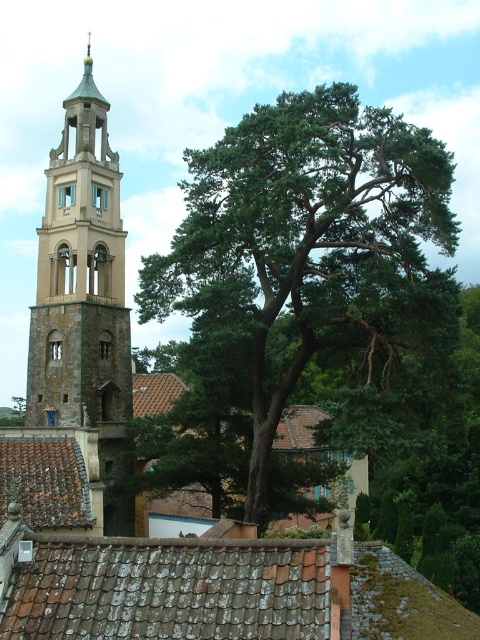
You are standing in front of the bell tower and notice a green leafy tree at center and a brown tile roof at lower center. Which object is taller?

The green leafy tree at center is taller than the brown tile roof at lower center.

You are standing in front of the bell tower and want to take a photo of the green leafy tree at center. Where should you position yourself relative to the bell tower to capture the tree in the frame?

To capture the green leafy tree at center in the frame, you should position yourself at the coordinates corresponding to point 0.395 on the horizontal axis and 0.629 on the vertical axis relative to the bell tower.

From the picture: You are standing in front of the bell tower and looking at the green leafy tree at center. There is a point marked at coordinates (301,252). Can you tell me what this point is located on?

The point at coordinates (301,252) is located on the green leafy tree at center.